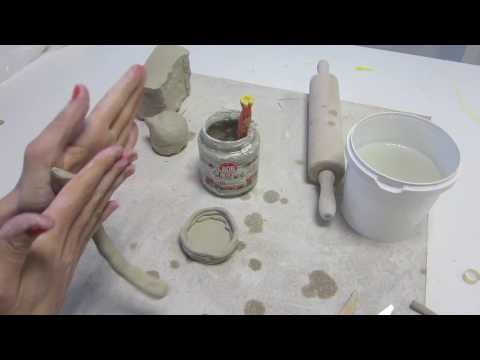
Find the location of a particular element. The height and width of the screenshot is (360, 480). rolling pin is located at coordinates (x=334, y=145).